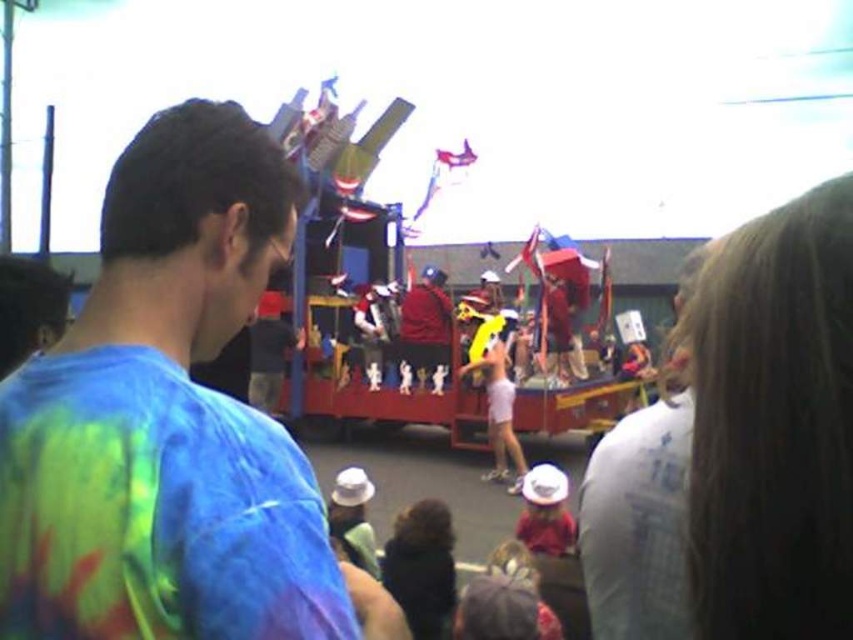
Question: Does tie-dye fabric shirt at center appear on the left side of white cotton shirt at upper right?

Choices:
 (A) yes
 (B) no

Answer: (A)

Question: Does tie-dye fabric shirt at center have a larger size compared to white cotton shirt at upper right?

Choices:
 (A) no
 (B) yes

Answer: (A)

Question: Which of the following is the closest to the observer?

Choices:
 (A) white cotton shirt at upper right
 (B) tie-dye fabric shirt at center

Answer: (B)

Question: Is tie-dye fabric shirt at center above white cotton shirt at upper right?

Choices:
 (A) yes
 (B) no

Answer: (B)